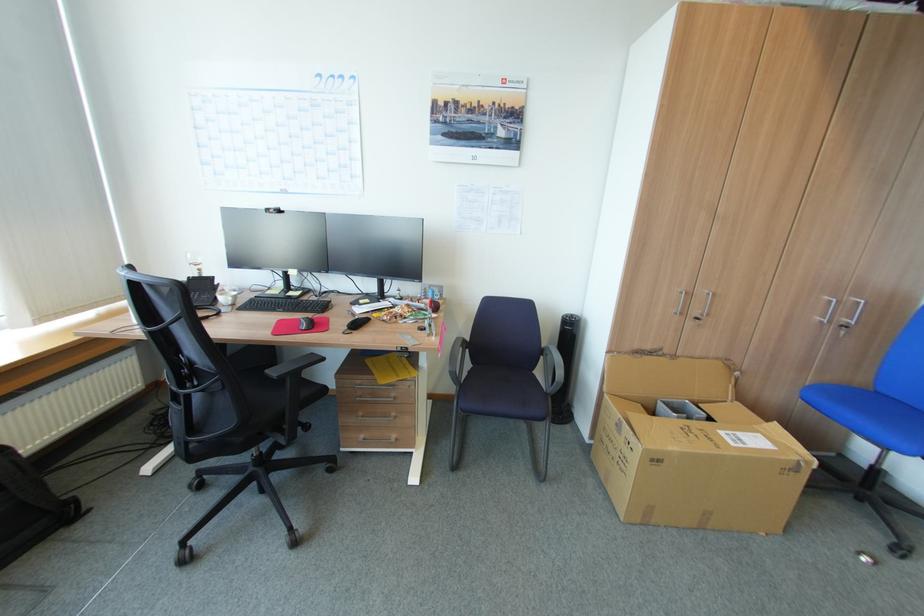
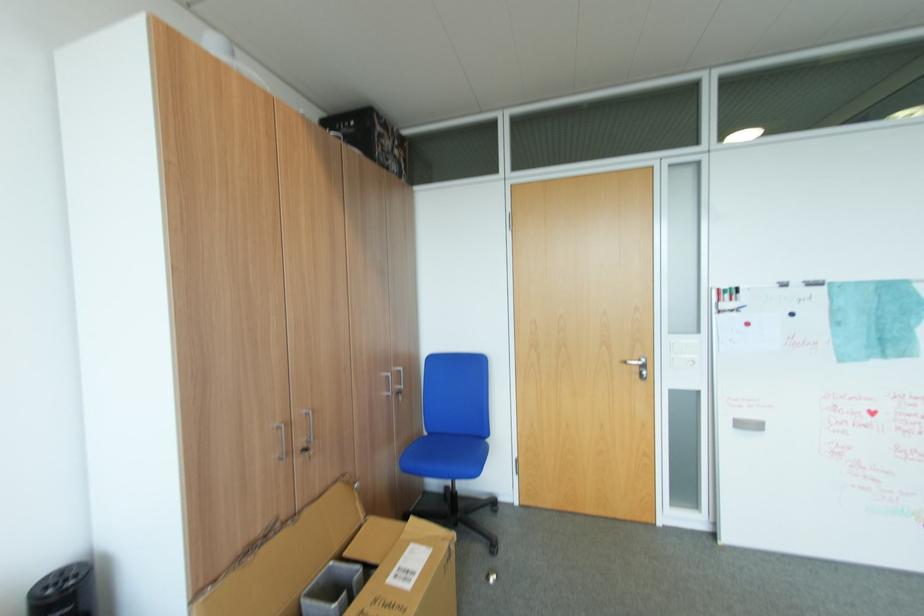
In the second image, find the point that corresponds to point 822,318 in the first image.

(390, 394)